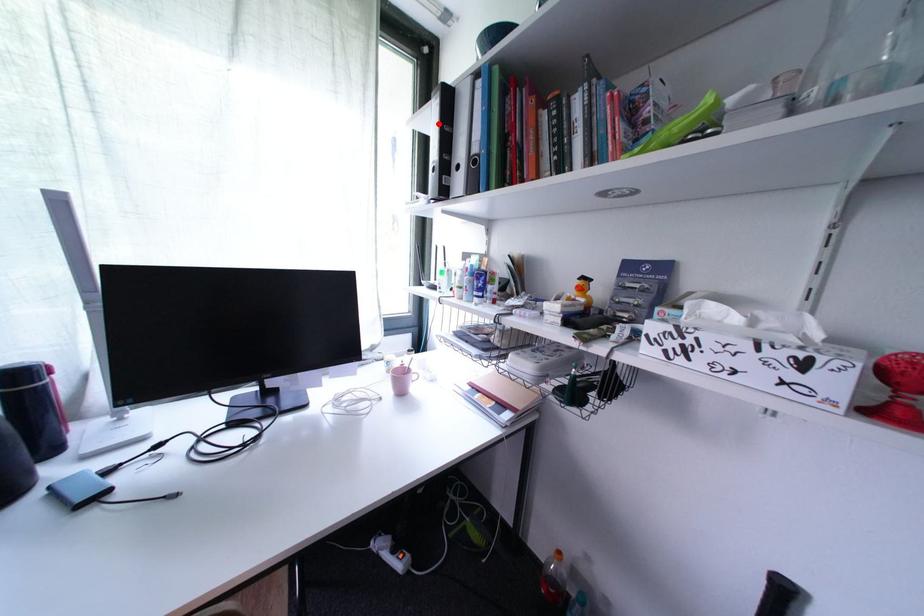
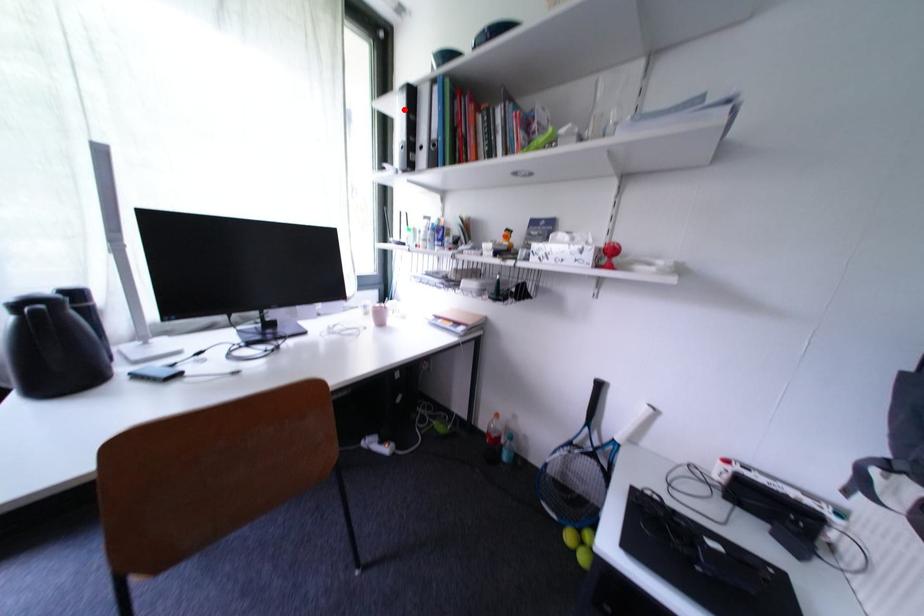
I am providing you with two images of the same scene from different viewpoints. A red point is marked on the first image and another point is marked on the second image. Do the highlighted points in image1 and image2 indicate the same real-world spot?

Yes